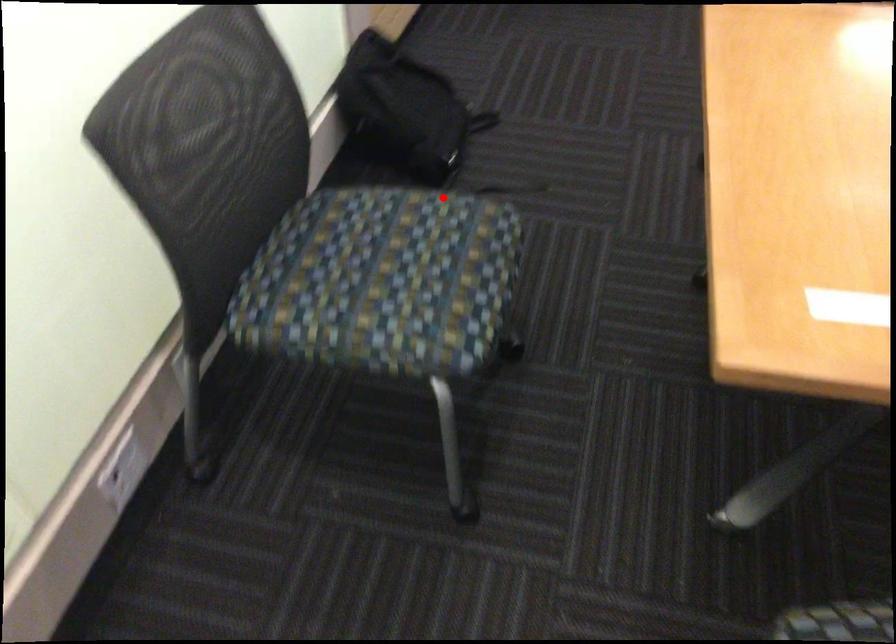
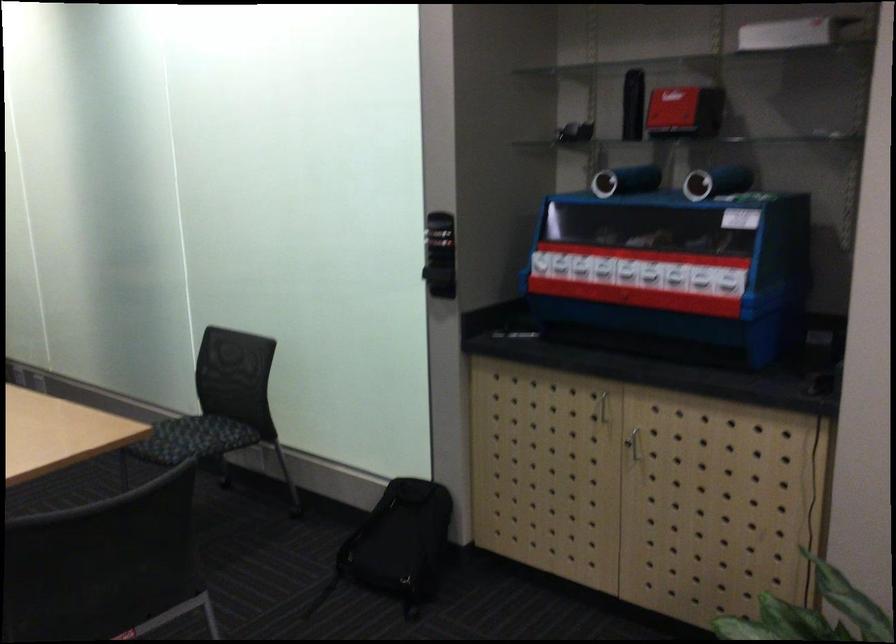
Question: I am providing you with two images of the same scene from different viewpoints. Image1 has a red point marked. In image2, the corresponding 3D location appears at what relative position? Reply with the corresponding letter.

Choices:
 (A) Closer
 (B) Farther

Answer: (B)